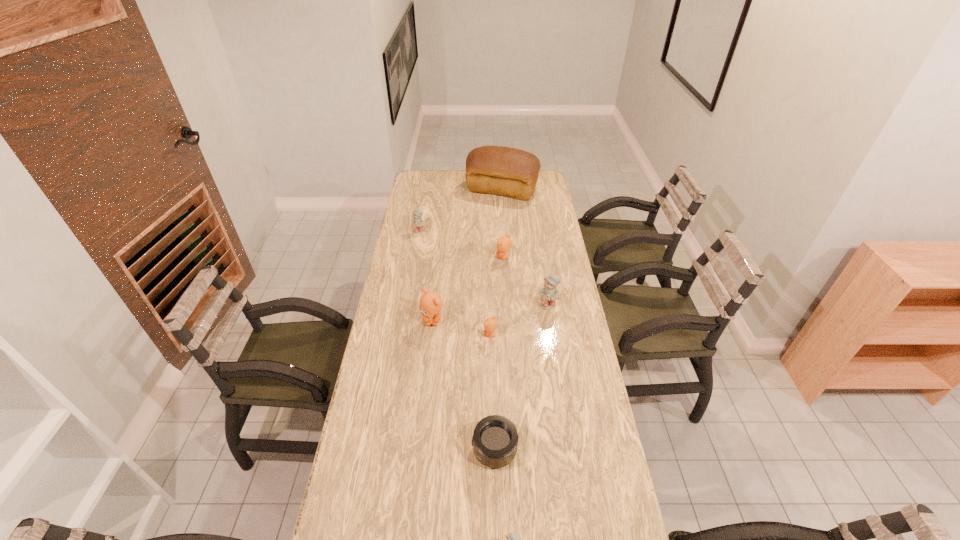
Find the location of a particular element. The width and height of the screenshot is (960, 540). blank space at the left edge of the desktop is located at coordinates (400, 309).

The height and width of the screenshot is (540, 960). I want to click on vacant space at the right edge of the desktop, so click(x=547, y=203).

You are a GUI agent. You are given a task and a screenshot of the screen. Output one action in this format:
    pyautogui.click(x=<x>, y=<y>)
    Task: Click on the blank area at the far right corner
    
    Given the screenshot: What is the action you would take?
    pyautogui.click(x=542, y=176)

Image resolution: width=960 pixels, height=540 pixels. What are the coordinates of `unoccupied area between the rightmost teddy bear and the second smallest brown teddy bear` in the screenshot? It's located at pos(526,281).

Image resolution: width=960 pixels, height=540 pixels. I want to click on vacant point located between the farthest object and the second smallest brown teddy bear, so click(x=503, y=224).

Where is `vacant space that is in between the farthest object and the third farthest teddy bear`? vacant space that is in between the farthest object and the third farthest teddy bear is located at coordinates (x=525, y=247).

Identify the location of free spot between the second nearest object and the second teddy bear from left to right. (464, 385).

The height and width of the screenshot is (540, 960). Identify the location of free area in between the third farthest teddy bear and the farthest teddy bear. (484, 268).

Where is `free space between the leftmost object and the fifth farthest teddy bear`? free space between the leftmost object and the fifth farthest teddy bear is located at coordinates (455, 283).

Find the location of a particular element. The width and height of the screenshot is (960, 540). blank region between the fourth farthest teddy bear and the leftmost blue teddy bear is located at coordinates (426, 275).